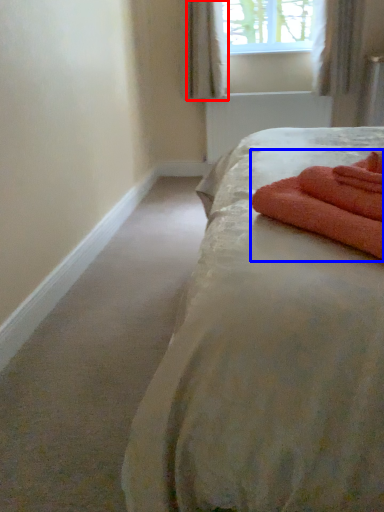
Question: Among these objects, which one is nearest to the camera, curtain (highlighted by a red box) or bath towel (highlighted by a blue box)?

Choices:
 (A) curtain
 (B) bath towel

Answer: (B)